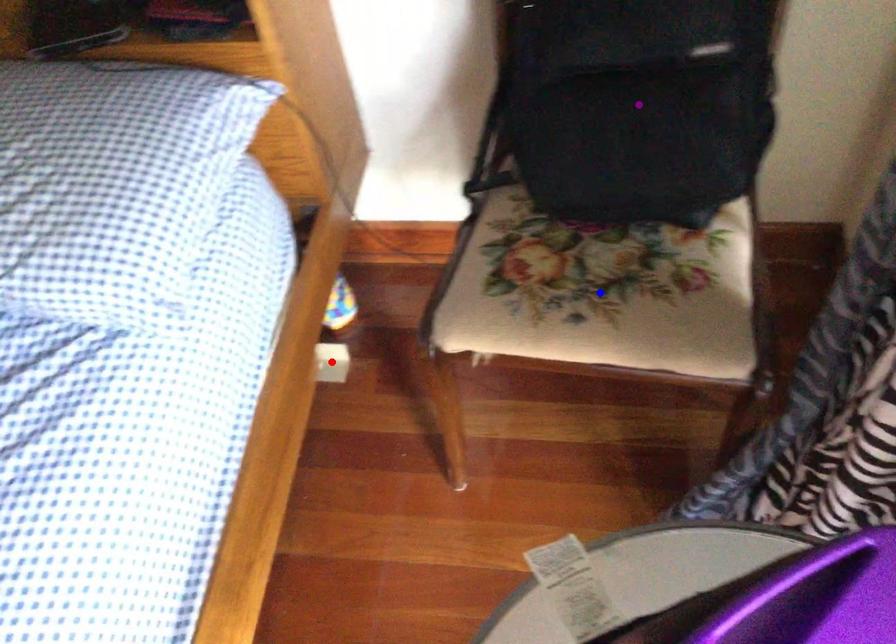
Order these from nearest to farthest:
1. blue point
2. purple point
3. red point

purple point < blue point < red point